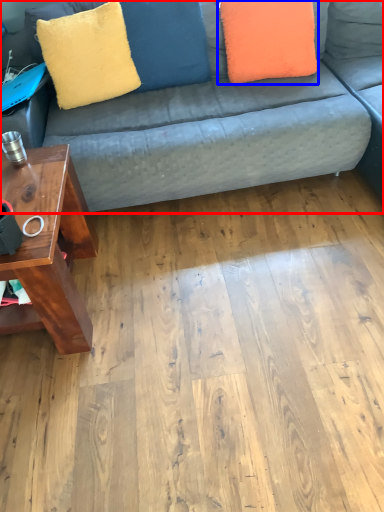
Question: Which object is closer to the camera taking this photo, studio couch (highlighted by a red box) or pillow (highlighted by a blue box)?

Choices:
 (A) studio couch
 (B) pillow

Answer: (A)